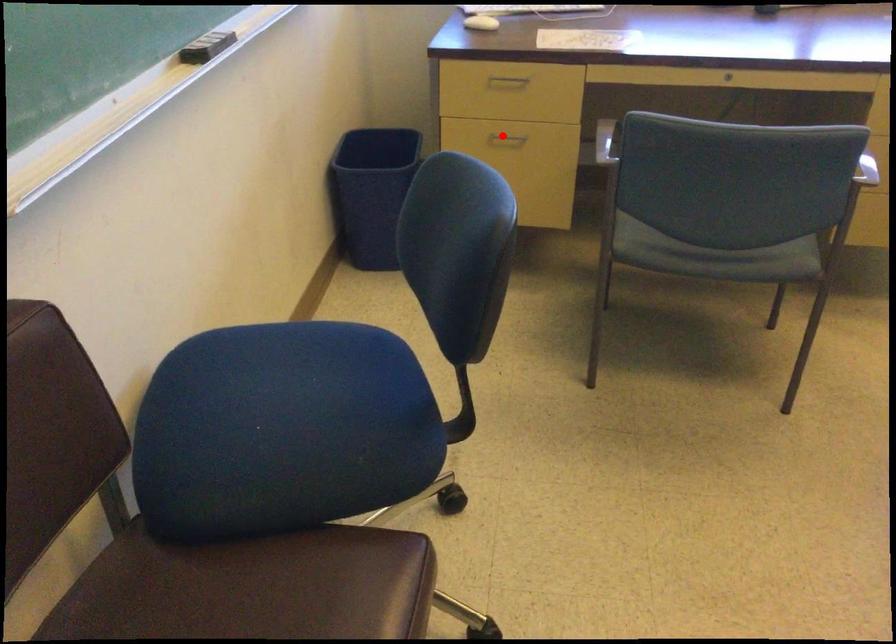
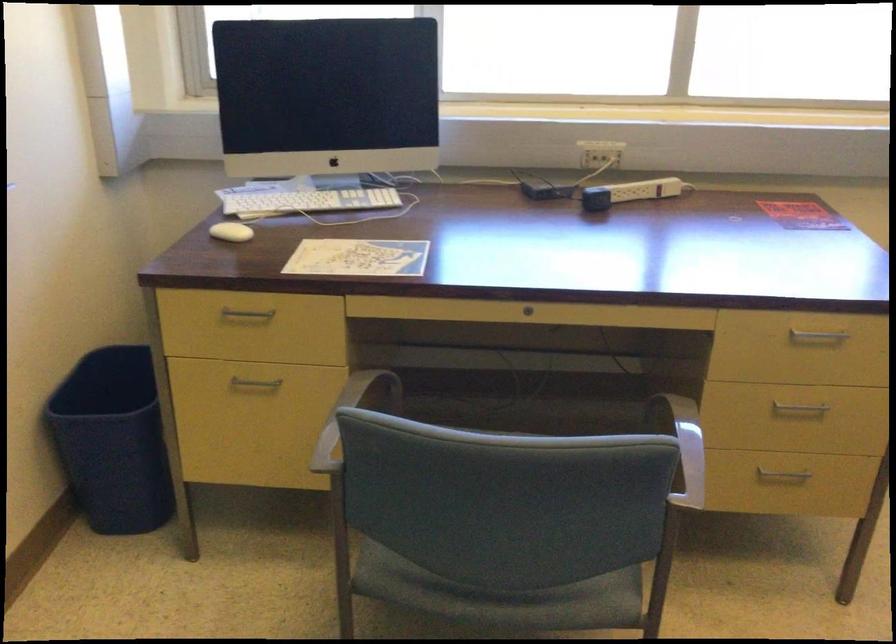
Question: I am providing you with two images of the same scene from different viewpoints. Given a red point in image1, look at the same physical point in image2. Is it:

Choices:
 (A) Closer to the viewpoint
 (B) Farther from the viewpoint

Answer: (A)